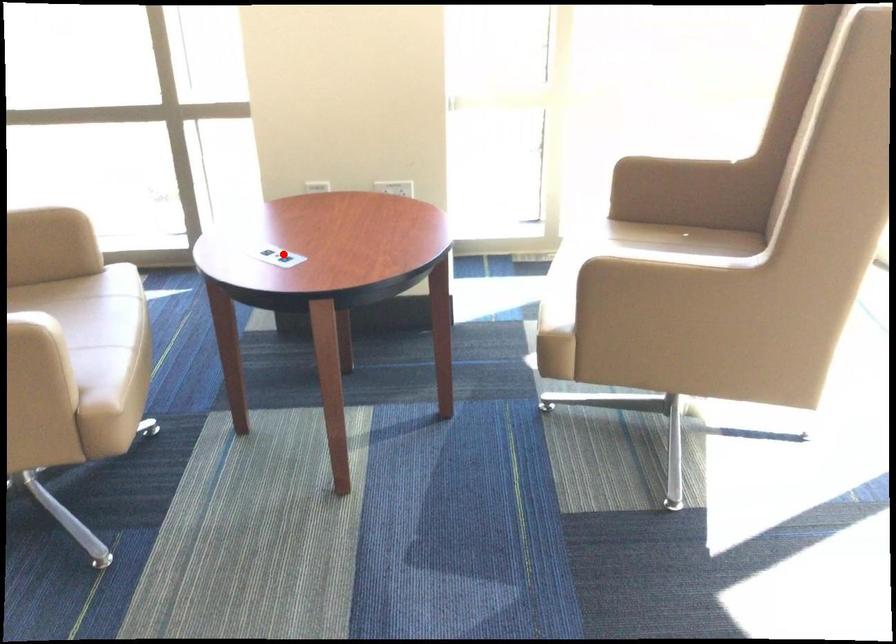
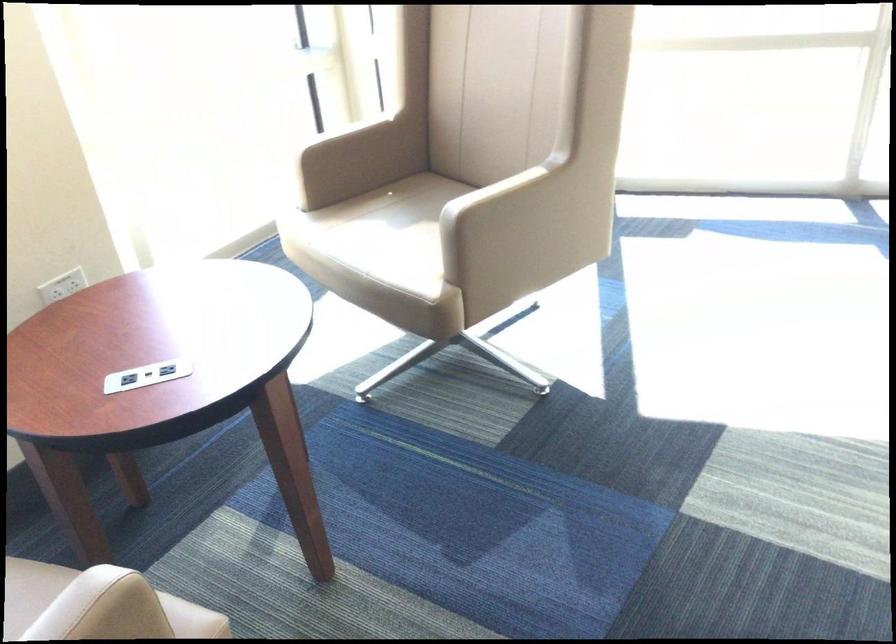
Find the pixel in the second image that matches the highlighted location in the first image.

(147, 375)